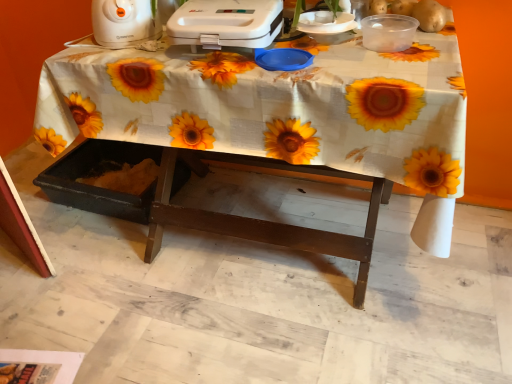
Question: Is point (284, 114) positioned closer to the camera than point (117, 28)?

Choices:
 (A) closer
 (B) farther

Answer: (A)

Question: From the image's perspective, relative to white plastic toaster at upper left, positioned as the first appliance in left-to-right order, is white fabric-covered table at center above or below?

Choices:
 (A) above
 (B) below

Answer: (B)

Question: Which of these objects is positioned closest to the white plastic toaster at upper center, which is the 2th appliance from left to right?

Choices:
 (A) white plastic toaster at upper left, positioned as the first appliance in left-to-right order
 (B) white fabric-covered table at center

Answer: (B)

Question: Which of these objects is positioned farthest from the white plastic toaster at upper center, which is the 2th appliance from left to right?

Choices:
 (A) white fabric-covered table at center
 (B) white plastic toaster at upper left, positioned as the first appliance in left-to-right order

Answer: (B)